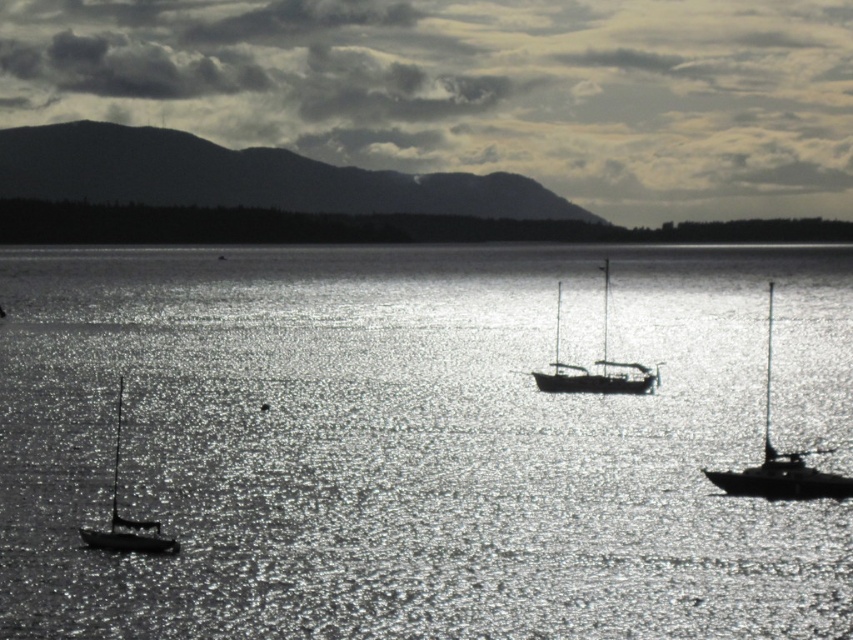
Question: Which point is farther to the camera?

Choices:
 (A) (773, 538)
 (B) (622, 376)

Answer: (B)

Question: In this image, where is silvery metallic sailboat at right located relative to silvery metallic sailboat at center?

Choices:
 (A) above
 (B) below

Answer: (B)

Question: Estimate the real-world distances between objects in this image. Which object is closer to the silvery metallic sailboat at lower left?

Choices:
 (A) silvery metallic sailboat at right
 (B) sparkling silver water at center

Answer: (A)

Question: Does silvery metallic sailboat at right lie in front of silvery metallic sailboat at center?

Choices:
 (A) yes
 (B) no

Answer: (A)

Question: Which of the following is the closest to the observer?

Choices:
 (A) sparkling silver water at center
 (B) silvery metallic sailboat at center
 (C) silvery metallic sailboat at right
 (D) silvery metallic sailboat at lower left

Answer: (A)

Question: In this image, where is sparkling silver water at center located relative to silvery metallic sailboat at center?

Choices:
 (A) right
 (B) left

Answer: (B)